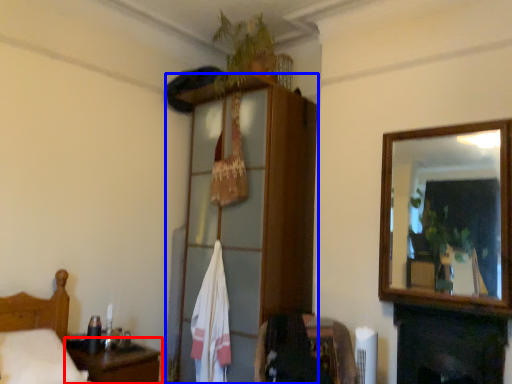
Question: Which point is closer to the camera, table (highlighted by a red box) or dresser (highlighted by a blue box)?

Choices:
 (A) table
 (B) dresser

Answer: (A)